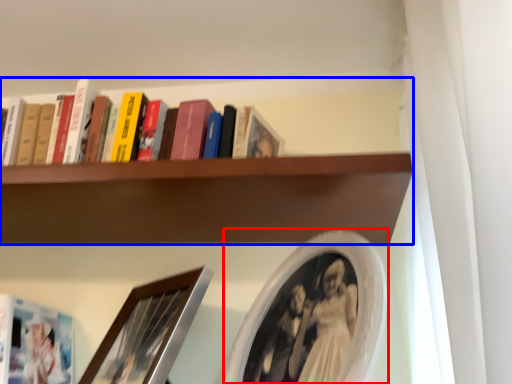
Question: Which of the following is the farthest to the observer, picture frame (highlighted by a red box) or shelf (highlighted by a blue box)?

Choices:
 (A) picture frame
 (B) shelf

Answer: (B)